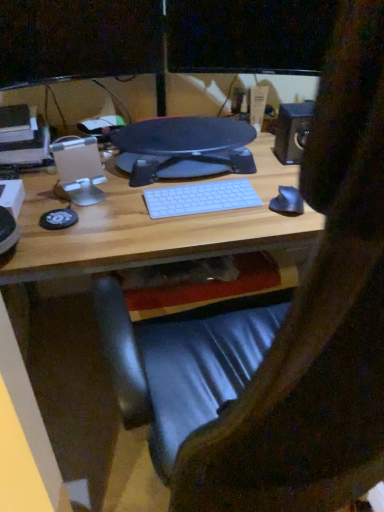
Question: Is point (317, 42) closer or farther from the camera than point (100, 30)?

Choices:
 (A) farther
 (B) closer

Answer: (A)

Question: In the image, is matte black monitor at upper center, which is counted as the 1th computer monitor, starting from the right, positioned in front of or behind matte black monitor at upper center, the 1th computer monitor when ordered from left to right?

Choices:
 (A) front
 (B) behind

Answer: (B)

Question: Based on their relative distances, which object is farther from the matte black monitor at upper center, which is the 2th computer monitor from left to right?

Choices:
 (A) white matte keyboard at center
 (B) wooden desk at center
 (C) metallic black speaker at upper right
 (D) glossy black monitor at center
 (E) matte black monitor at upper center, which appears as the 2th computer monitor when viewed from the right

Answer: (A)

Question: Which object is positioned closest to the glossy black monitor at center?

Choices:
 (A) white matte keyboard at center
 (B) matte black monitor at upper center, which is the 2th computer monitor from left to right
 (C) matte black monitor at upper center, the 1th computer monitor when ordered from left to right
 (D) wooden desk at center
 (E) metallic black speaker at upper right

Answer: (D)